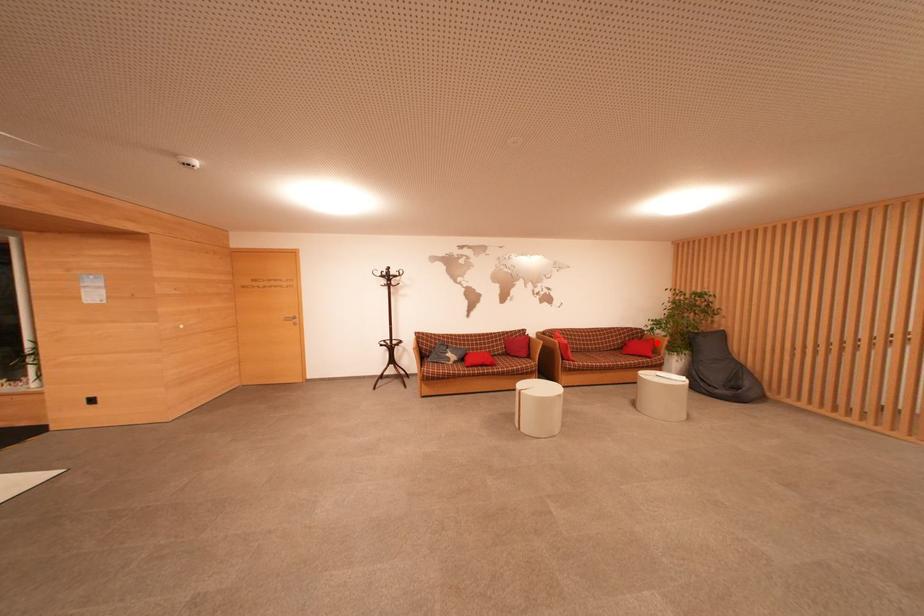
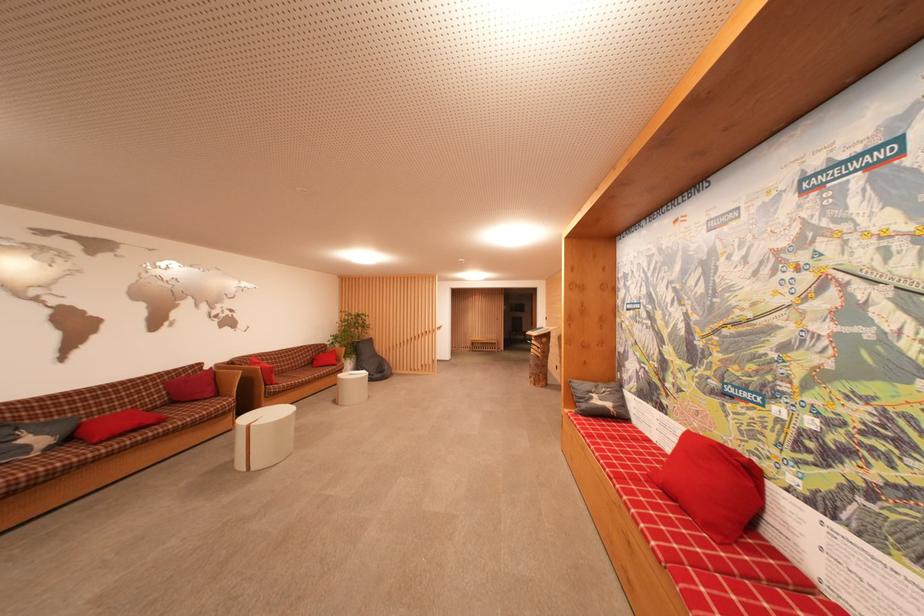
In the second image, find the point that corresponds to the highlighted location in the first image.

(338, 354)